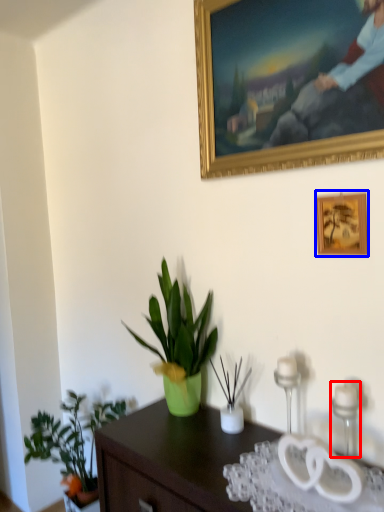
Question: Which of the following is the farthest to the observer, candle holder (highlighted by a red box) or picture frame (highlighted by a blue box)?

Choices:
 (A) candle holder
 (B) picture frame

Answer: (B)